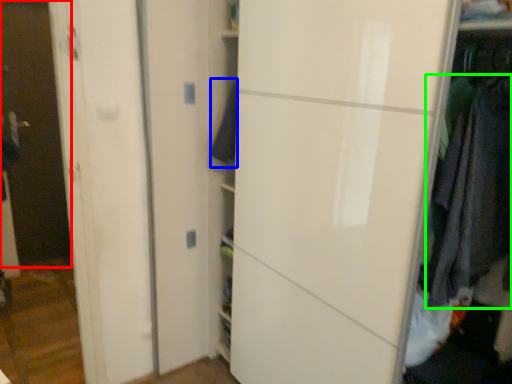
Question: Estimate the real-world distances between objects in this image. Which object is closer to glass door (highlighted by a red box), clothing (highlighted by a blue box) or clothing (highlighted by a green box)?

Choices:
 (A) clothing
 (B) clothing

Answer: (A)